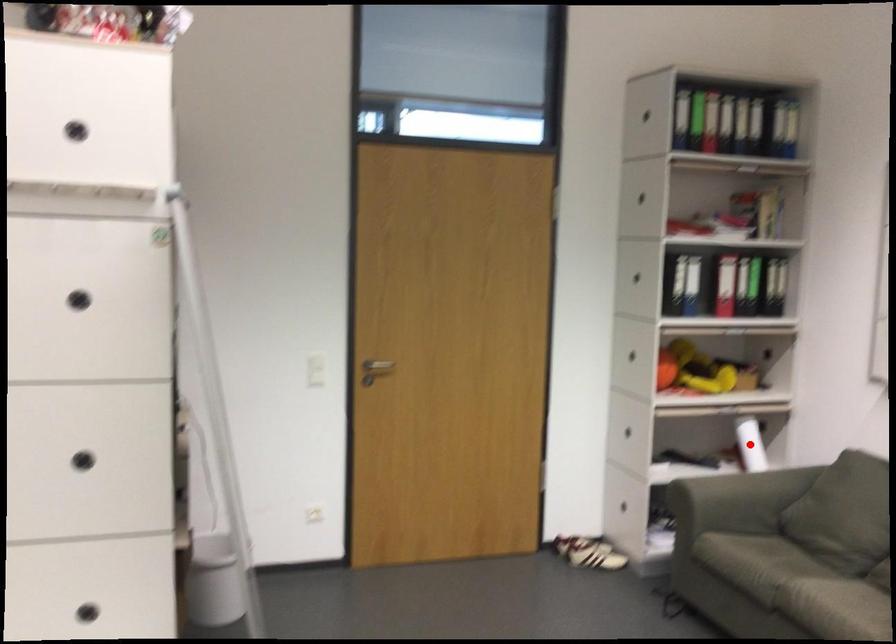
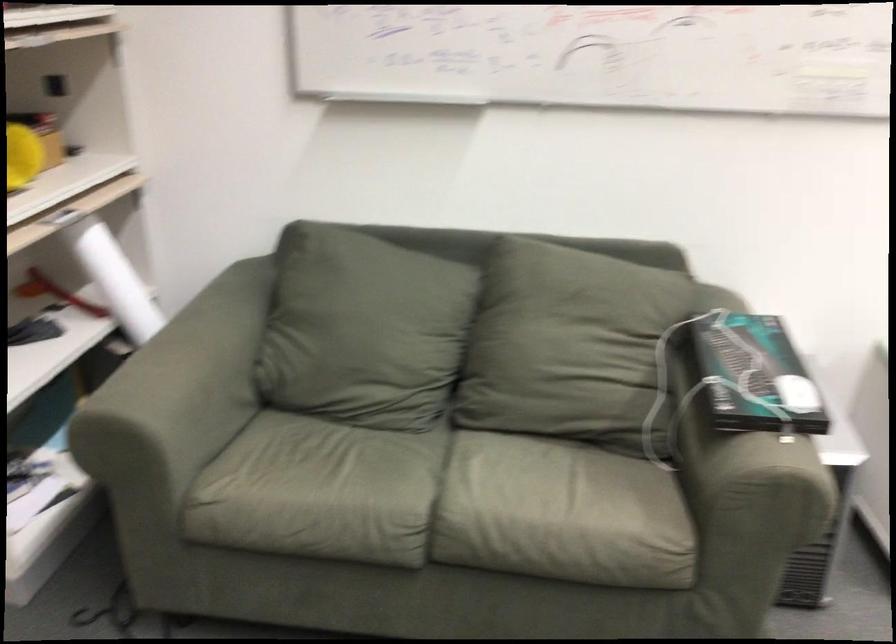
Question: I am providing you with two images of the same scene from different viewpoints. A red point is marked on the first image. Can you still see the location of the red point in image 2?

Choices:
 (A) Yes
 (B) No

Answer: (B)